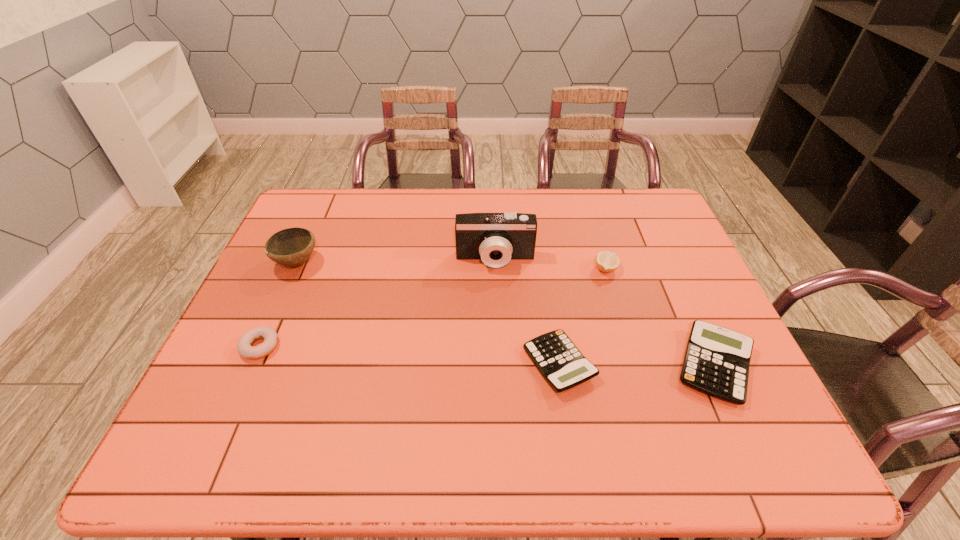
Where is `the left calculator`? the left calculator is located at coordinates (563, 366).

This screenshot has width=960, height=540. I want to click on the right calculator, so click(x=716, y=362).

What are the coordinates of `the taller calculator` in the screenshot? It's located at (716, 362).

Locate an element on the screen. Image resolution: width=960 pixels, height=540 pixels. the tallest object is located at coordinates (495, 238).

This screenshot has height=540, width=960. What are the coordinates of `the fifth object from left to right` in the screenshot? It's located at (606, 261).

The image size is (960, 540). Find the location of `doughnut`. doughnut is located at coordinates (244, 348).

Find the location of a particular element. The image size is (960, 540). bowl is located at coordinates (291, 247).

Find the location of a particular element. This screenshot has height=540, width=960. free space located on the right of the shorter calculator is located at coordinates (640, 364).

I want to click on free space located 0.050m on the left of the taller calculator, so click(651, 366).

Find the location of a particular element. The image size is (960, 540). vacant space located 0.350m on the lens of the tallest object is located at coordinates (499, 375).